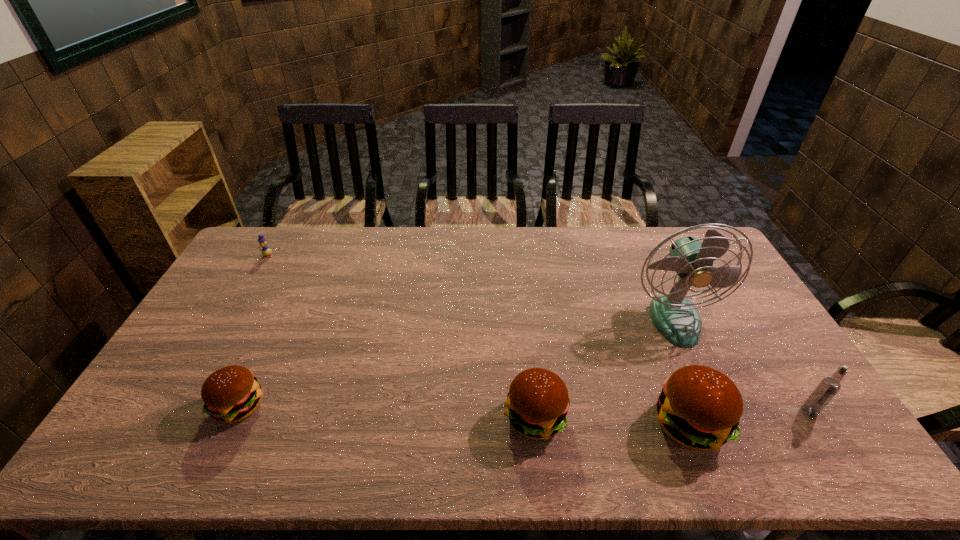
Please mark a free spot for a new hamburger to balance the arrangement. Please provide its 2D coordinates. Your answer should be formatted as a tuple, i.e. [(x, y)], where the tuple contains the x and y coordinates of a point satisfying the conditions above.

[(386, 412)]